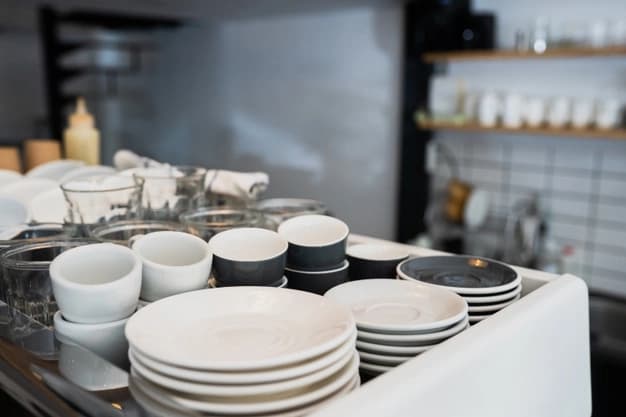
The image size is (626, 417). What are the coordinates of `clear drinking glass` in the screenshot? It's located at (23, 270), (94, 200), (128, 228), (168, 189), (212, 216), (282, 207).